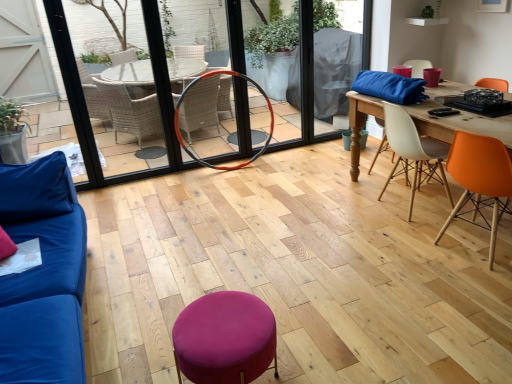
Question: From a real-world perspective, relative to white plastic chair at center right, acting as the 1th chair starting from the back, is orange rubber hula hoop at center vertically above or below?

Choices:
 (A) above
 (B) below

Answer: (A)

Question: In the image, is orange rubber hula hoop at center on the left side or the right side of white plastic chair at center right, acting as the 1th chair starting from the back?

Choices:
 (A) left
 (B) right

Answer: (A)

Question: Considering the real-world distances, which object is farthest from the purple fabric stool at center?

Choices:
 (A) orange matte chair at right, which appears as the 2th chair when viewed from the back
 (B) white plastic chair at center right, the second chair when ordered from front to back
 (C) orange rubber hula hoop at center
 (D) blue fabric couch at left
 (E) orange rubber hula hoop at center

Answer: (C)

Question: Which of these objects is positioned closest to the orange rubber hula hoop at center?

Choices:
 (A) blue fabric couch at left
 (B) orange matte chair at right, the first chair in the front-to-back sequence
 (C) orange rubber hula hoop at center
 (D) white plastic chair at center right, the second chair when ordered from front to back
 (E) purple fabric stool at center

Answer: (C)